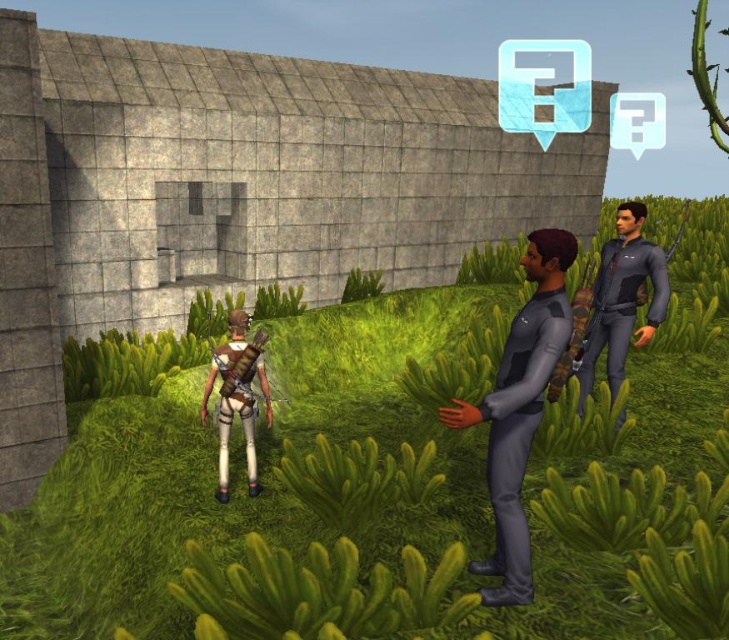
Question: Which point is closer to the camera?

Choices:
 (A) dark gray matte uniform at center
 (B) white matte pants at center

Answer: (A)

Question: Does green grass at center appear over white matte pants at center?

Choices:
 (A) no
 (B) yes

Answer: (B)

Question: Among these points, which one is nearest to the camera?

Choices:
 (A) (x=639, y=241)
 (B) (x=515, y=467)
 (C) (x=340, y=352)

Answer: (B)

Question: In this image, where is green grass at center located relative to dark gray matte uniform at center?

Choices:
 (A) right
 (B) left

Answer: (A)

Question: Observing the image, what is the correct spatial positioning of dark gray matte uniform at center in reference to white matte pants at center?

Choices:
 (A) above
 (B) below

Answer: (A)

Question: Which object appears farthest from the camera in this image?

Choices:
 (A) dark gray fabric shirt at right
 (B) dark gray matte uniform at center
 (C) white matte pants at center
 (D) green grass at center

Answer: (C)